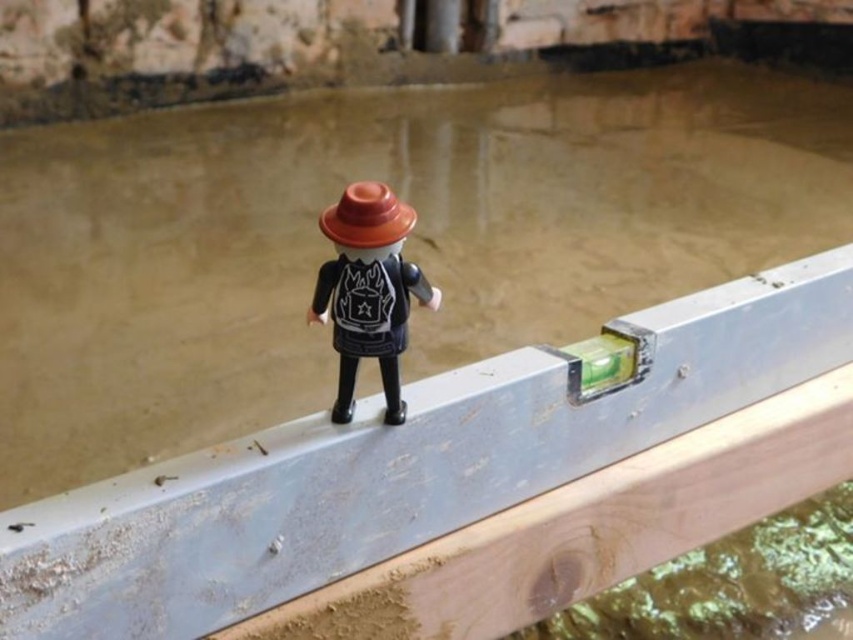
Question: Which point is closer to the camera?

Choices:
 (A) (409, 273)
 (B) (364, 218)
 (C) (471, 433)

Answer: (B)

Question: Can you confirm if metal/wooden ledge at center is wider than matte black figure at center?

Choices:
 (A) yes
 (B) no

Answer: (A)

Question: Where is metal/wooden ledge at center located in relation to matte black figure at center in the image?

Choices:
 (A) left
 (B) right

Answer: (B)

Question: Where is matte black figure at center located in relation to matte orange cone at center in the image?

Choices:
 (A) right
 (B) left

Answer: (A)

Question: Which point appears closest to the camera in this image?

Choices:
 (A) (339, 202)
 (B) (276, 449)

Answer: (A)

Question: Which point is farther from the camera taking this photo?

Choices:
 (A) (360, 220)
 (B) (325, 554)

Answer: (B)